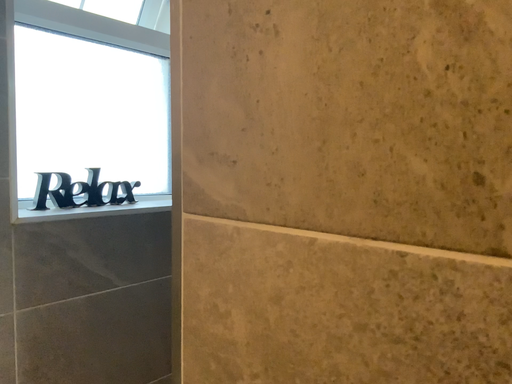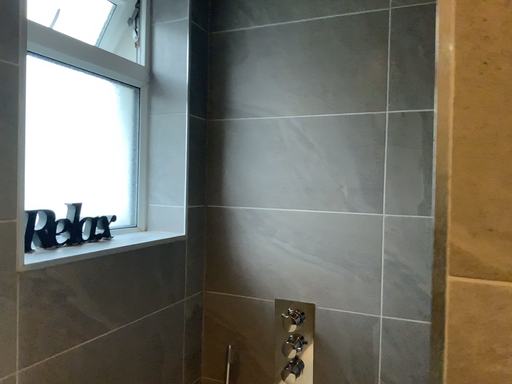
Question: Which way did the camera rotate in the video?

Choices:
 (A) rotated right
 (B) rotated left

Answer: (A)